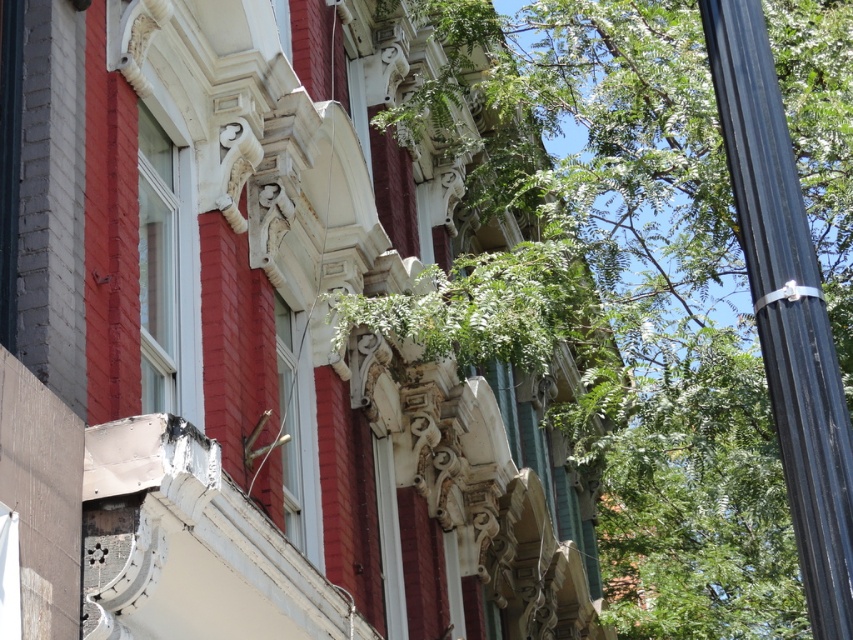
Who is positioned more to the right, green leafy tree at center or black metallic pole at right?

green leafy tree at center is more to the right.

Does green leafy tree at center have a greater width compared to black metallic pole at right?

Indeed, green leafy tree at center has a greater width compared to black metallic pole at right.

Is point (477, 276) positioned before point (792, 513)?

That is False.

I want to click on green leafy tree at center, so click(x=663, y=284).